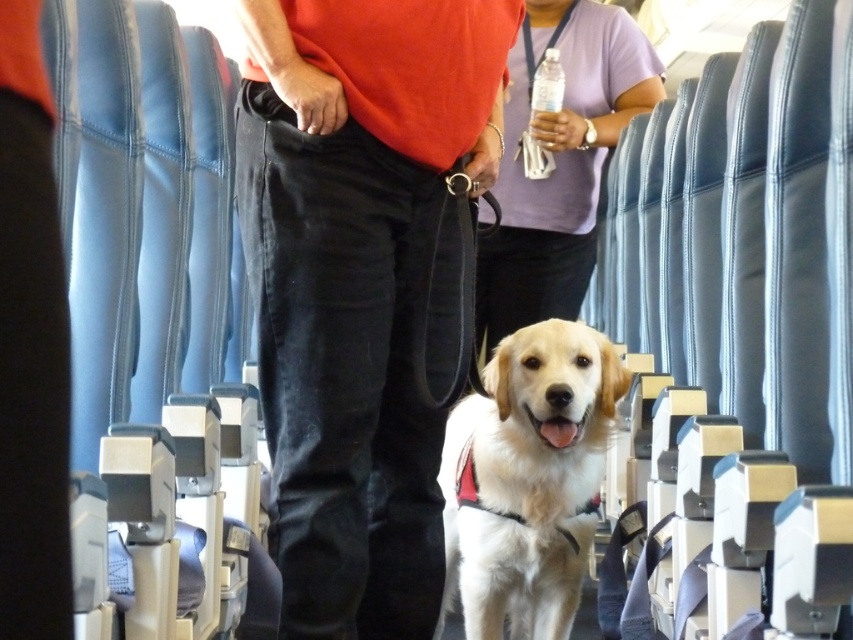
Is matte black pants at center taller than white fur dog at center?

Indeed, matte black pants at center has a greater height compared to white fur dog at center.

Does matte black pants at center appear on the right side of white fur dog at center?

Incorrect, matte black pants at center is not on the right side of white fur dog at center.

Where is `matte black pants at center`? Image resolution: width=853 pixels, height=640 pixels. matte black pants at center is located at coordinates (358, 282).

Is white fur dog at center shorter than clear plastic bottle at upper center?

No, white fur dog at center is not shorter than clear plastic bottle at upper center.

Which is in front, point (490, 554) or point (548, 61)?

Positioned in front is point (490, 554).

This screenshot has height=640, width=853. In order to click on white fur dog at center in this screenshot , I will do `click(527, 480)`.

Is white fur dog at center taller than purple fabric shirt at center?

In fact, white fur dog at center may be shorter than purple fabric shirt at center.

Find the location of a particular element. This screenshot has height=640, width=853. white fur dog at center is located at coordinates (527, 480).